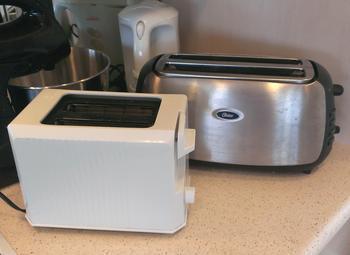
The height and width of the screenshot is (255, 350). I want to click on counter edge, so click(x=328, y=241).